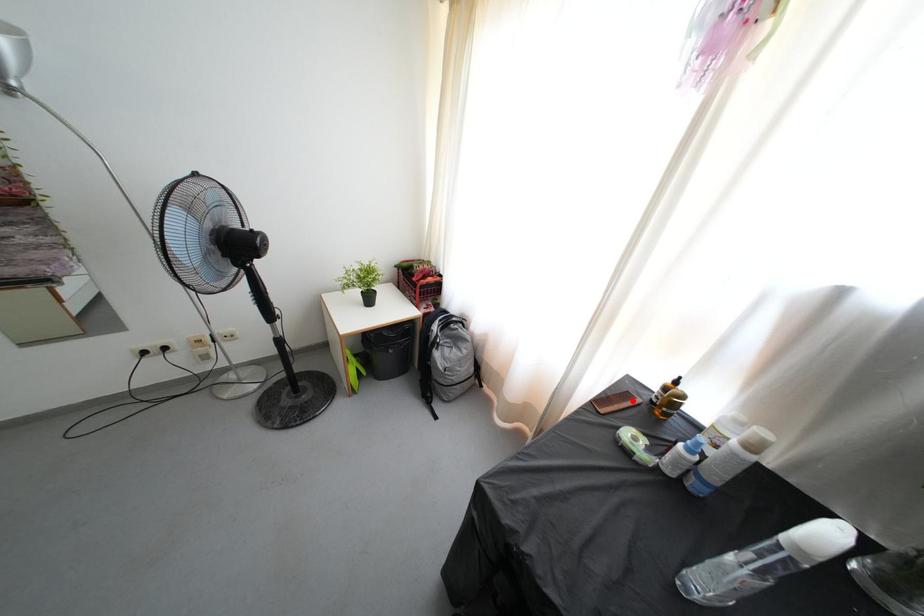
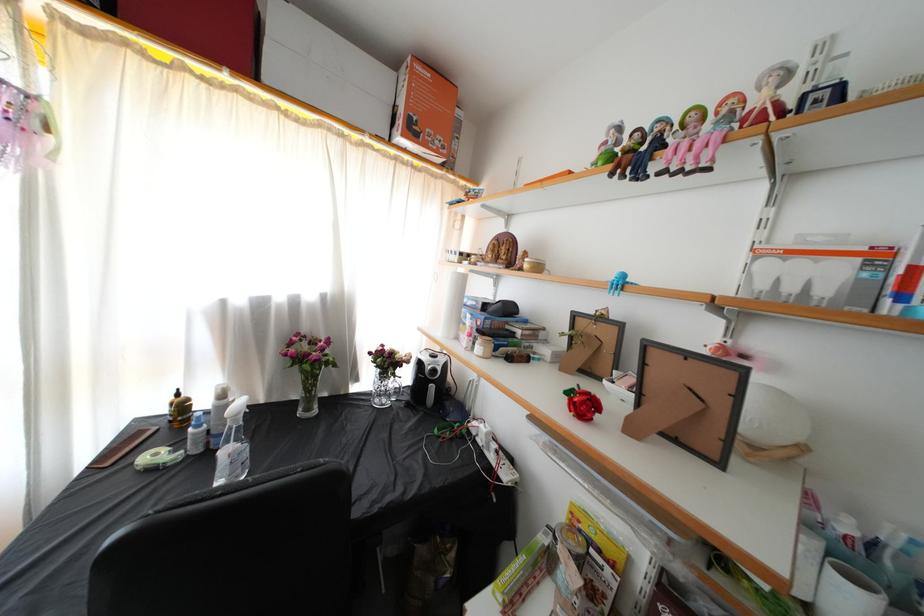
Find the pixel in the second image that matches the highlighted location in the first image.

(144, 439)